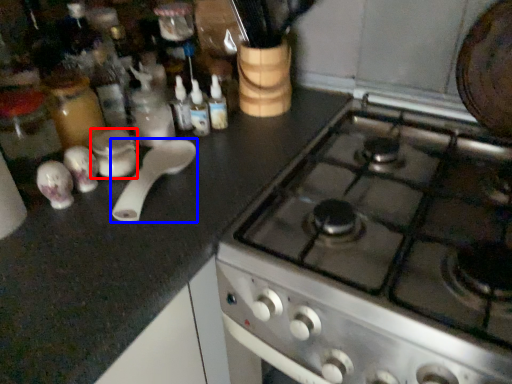
Question: Which object is closer to the camera taking this photo, appliance (highlighted by a red box) or kitchen appliance (highlighted by a blue box)?

Choices:
 (A) appliance
 (B) kitchen appliance

Answer: (B)